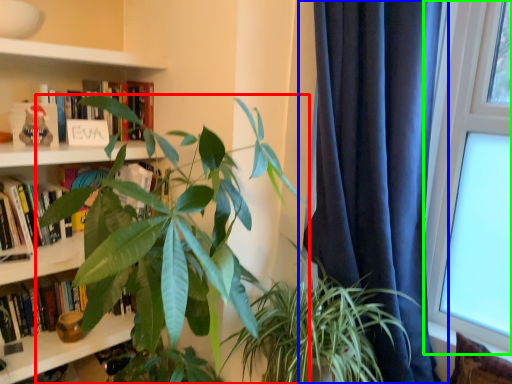
Question: Considering the real-world distances, which object is farthest from houseplant (highlighted by a red box)? curtain (highlighted by a blue box) or window (highlighted by a green box)?

Choices:
 (A) curtain
 (B) window

Answer: (B)